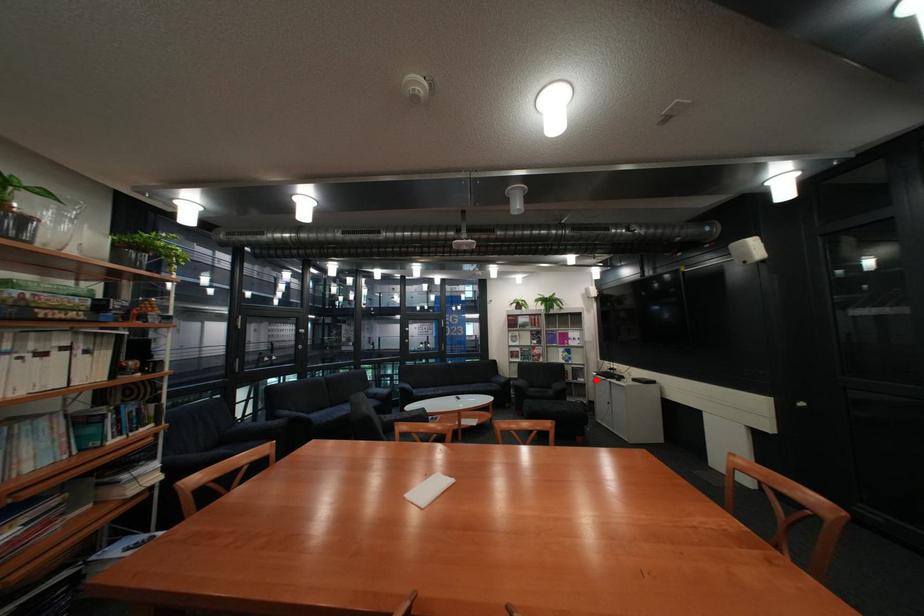
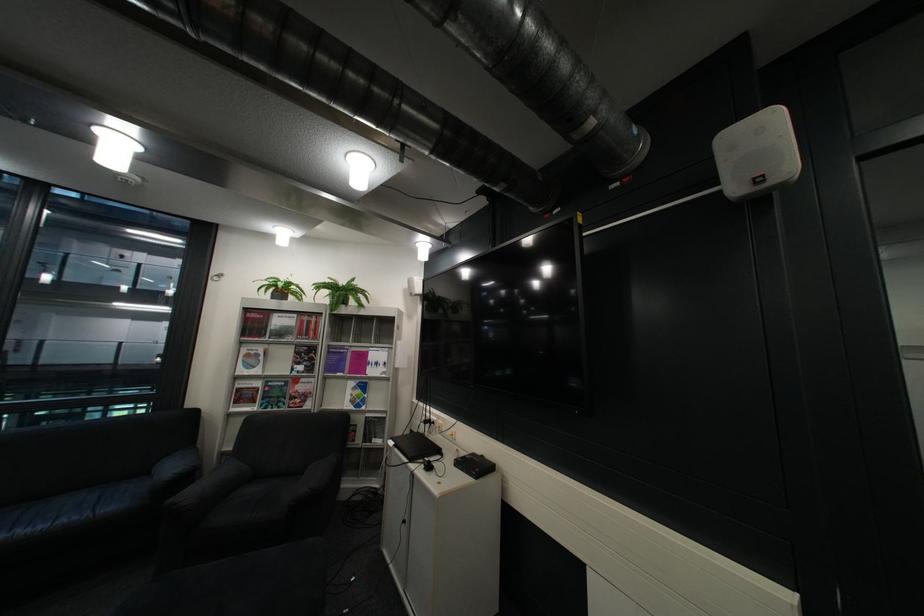
Question: I am providing you with two images of the same scene from different viewpoints. In image1, a red point is highlighted. Considering the same 3D point in image2, which of the following is correct?

Choices:
 (A) It is closer
 (B) It is farther

Answer: (A)